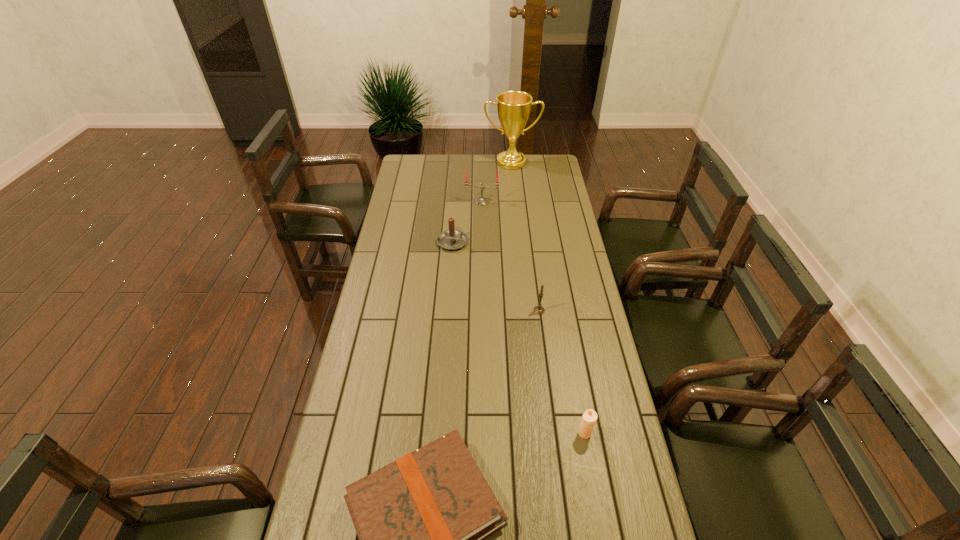
You are a GUI agent. You are given a task and a screenshot of the screen. Output one action in this format:
    pyautogui.click(x=<x>, y=<y>)
    Task: Click on the tallest object
    
    Given the screenshot: What is the action you would take?
    pyautogui.click(x=513, y=107)

Identify the location of the farthest object. Image resolution: width=960 pixels, height=540 pixels. (513, 107).

Find the location of a particular element. Image resolution: width=960 pixels, height=540 pixels. the tallest candle is located at coordinates (481, 200).

Identify the location of the farthest candle. (481, 200).

You are a GUI agent. You are given a task and a screenshot of the screen. Output one action in this format:
    pyautogui.click(x=<x>, y=<y>)
    Task: Click on the third candle from left to right
    The image size is (960, 540).
    Given the screenshot: What is the action you would take?
    pyautogui.click(x=539, y=309)

The image size is (960, 540). In order to click on the third nearest object in this screenshot , I will do `click(539, 309)`.

Image resolution: width=960 pixels, height=540 pixels. I want to click on the third nearest candle, so click(x=451, y=239).

Find the location of `the rightmost candle`. the rightmost candle is located at coordinates (589, 418).

Locate an element on the screen. The width and height of the screenshot is (960, 540). free point located 0.320m by the handles of the tallest object is located at coordinates (516, 206).

The height and width of the screenshot is (540, 960). In order to click on free space located 0.270m on the front-facing side of the fifth nearest object in this screenshot , I will do click(x=482, y=241).